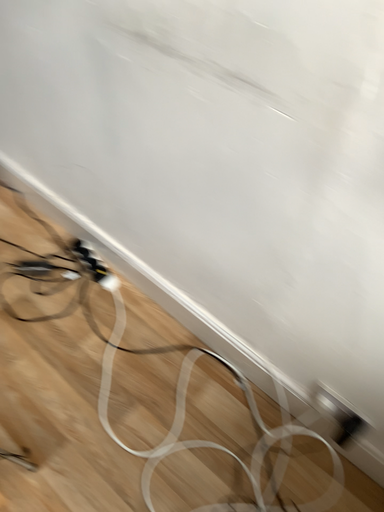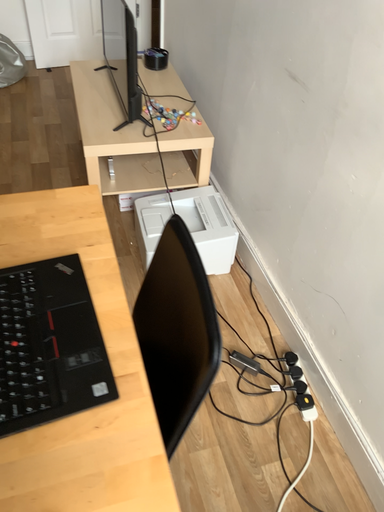
Question: Which way did the camera rotate in the video?

Choices:
 (A) rotated upward
 (B) rotated downward

Answer: (A)